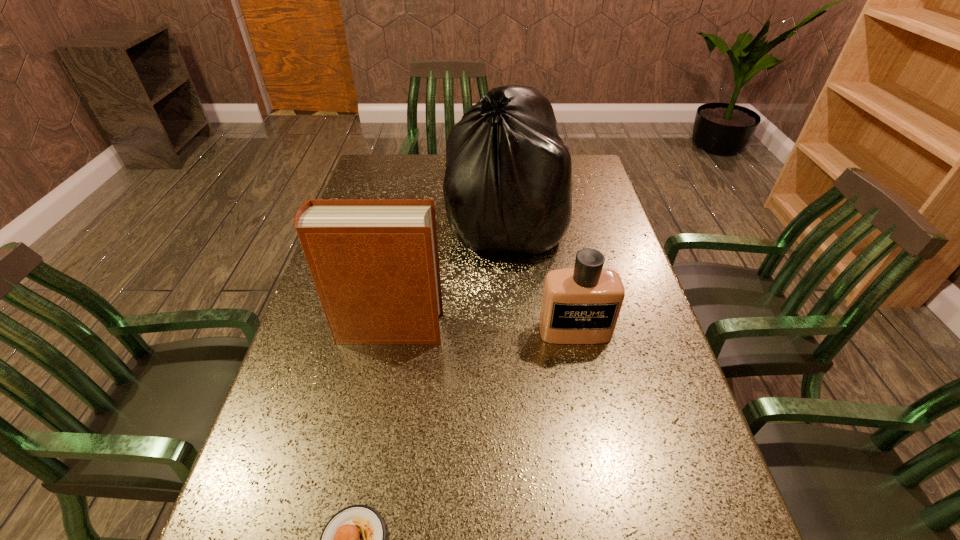
This screenshot has height=540, width=960. I want to click on the farthest object, so click(508, 185).

Image resolution: width=960 pixels, height=540 pixels. Find the location of `plastic bag`. plastic bag is located at coordinates (x=508, y=185).

I want to click on the second tallest object, so click(x=375, y=264).

The height and width of the screenshot is (540, 960). Find the location of `perfume`. perfume is located at coordinates (581, 305).

At what (x,y) coordinates should I click in order to perform the action: click on blank space located 0.160m on the front of the tallest object. Please return your answer as a coordinate pair (x, y). The image size is (960, 540). Looking at the image, I should click on (515, 308).

This screenshot has height=540, width=960. Identify the location of blank space located on the open cover of the second tallest object. click(517, 329).

Where is `vacant space located 0.300m on the front label of the perfume`? This screenshot has height=540, width=960. vacant space located 0.300m on the front label of the perfume is located at coordinates (604, 476).

Locate an element on the screen. Image resolution: width=960 pixels, height=540 pixels. object present at the far edge is located at coordinates click(x=508, y=185).

Image resolution: width=960 pixels, height=540 pixels. In order to click on object that is at the left edge in this screenshot , I will do `click(375, 264)`.

The width and height of the screenshot is (960, 540). What are the coordinates of `plastic bag located in the right edge section of the desktop` in the screenshot? It's located at (508, 185).